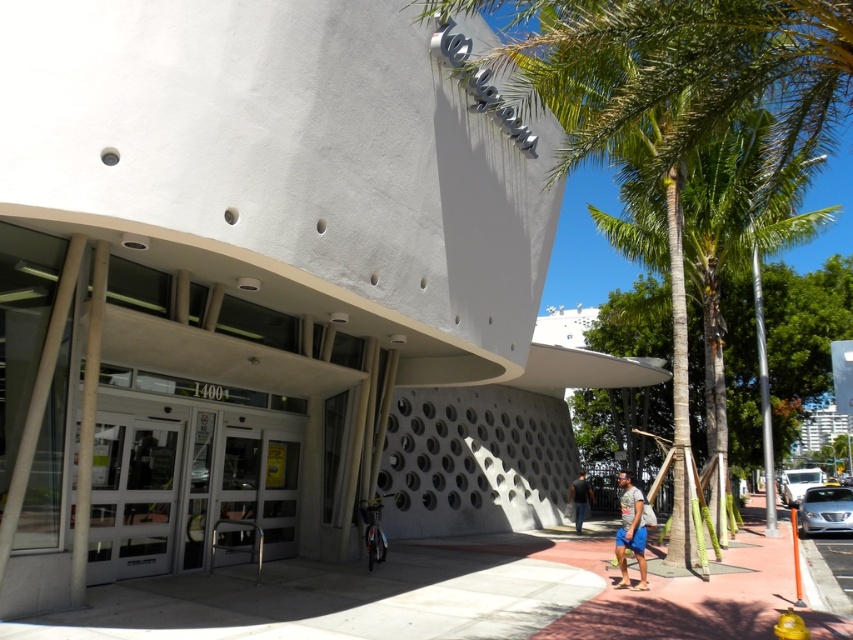
You are standing in front of the building and want to reach the point marked at coordinates point (142,588). Given that the distance from your current position to that point is 24.64 feet, can you estimate how far you need to walk to reach it?

The point (142,588) is 24.64 feet away from the viewer, so you need to walk approximately 24.64 feet to reach it.

You are a delivery person who needs to park your 5.5 meter long truck between the concrete sidewalk at center and the white glossy car at right. Can you safely park your truck in this space without overlapping either object?

The concrete sidewalk at center and white glossy car at right are 20.15 meters apart from each other. Since your truck is only 5.5 meters long, there is sufficient space between them to park without overlapping either object.